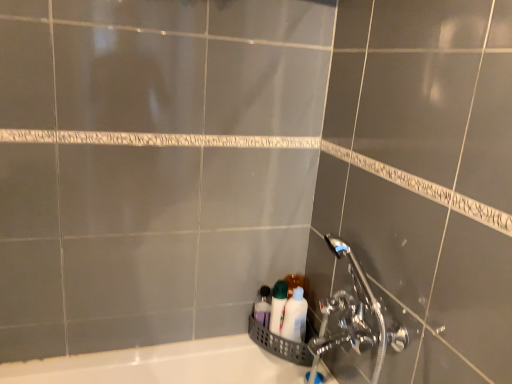
Identify the location of white glossy bottles at lower right, which ranks as the first toiletry in right-to-left order. The width and height of the screenshot is (512, 384). (295, 317).

This screenshot has width=512, height=384. Describe the element at coordinates (295, 317) in the screenshot. I see `white glossy bottles at lower right, which ranks as the first toiletry in right-to-left order` at that location.

This screenshot has width=512, height=384. What do you see at coordinates (263, 306) in the screenshot?
I see `translucent plastic bottles at lower center, marked as the 1th toiletry in a left-to-right arrangement` at bounding box center [263, 306].

At what (x,y) coordinates should I click in order to perform the action: click on translucent plastic bottles at lower center, which ranks as the 2th toiletry in right-to-left order. Please return your answer as a coordinate pair (x, y). The height and width of the screenshot is (384, 512). Looking at the image, I should click on (263, 306).

Find the location of a particular element. This screenshot has height=384, width=512. white glossy bottles at lower right, which ranks as the first toiletry in right-to-left order is located at coordinates (295, 317).

Does white glossy bottles at lower right, which ranks as the first toiletry in right-to-left order, appear on the left side of translucent plastic bottles at lower center, which ranks as the 2th toiletry in right-to-left order?

No.

Is white glossy bottles at lower right, the second toiletry positioned from the left, positioned in front of translucent plastic bottles at lower center, which ranks as the 2th toiletry in right-to-left order?

Yes, white glossy bottles at lower right, the second toiletry positioned from the left, is in front of translucent plastic bottles at lower center, which ranks as the 2th toiletry in right-to-left order.

Is point (295, 340) in front of point (267, 326)?

That is True.

From the image's perspective, between white glossy bottles at lower right, which ranks as the first toiletry in right-to-left order, and translucent plastic bottles at lower center, marked as the 1th toiletry in a left-to-right arrangement, which one is located above?

translucent plastic bottles at lower center, marked as the 1th toiletry in a left-to-right arrangement, is shown above in the image.

From a real-world perspective, between white glossy bottles at lower right, which ranks as the first toiletry in right-to-left order, and translucent plastic bottles at lower center, marked as the 1th toiletry in a left-to-right arrangement, who is vertically higher?

white glossy bottles at lower right, which ranks as the first toiletry in right-to-left order, from a real-world perspective.

Between white glossy bottles at lower right, the second toiletry positioned from the left, and translucent plastic bottles at lower center, which ranks as the 2th toiletry in right-to-left order, which one has smaller width?

translucent plastic bottles at lower center, which ranks as the 2th toiletry in right-to-left order, is thinner.

Is white glossy bottles at lower right, which ranks as the first toiletry in right-to-left order, taller or shorter than translucent plastic bottles at lower center, which ranks as the 2th toiletry in right-to-left order?

Clearly, white glossy bottles at lower right, which ranks as the first toiletry in right-to-left order, is taller compared to translucent plastic bottles at lower center, which ranks as the 2th toiletry in right-to-left order.

Looking at the image, does white glossy bottles at lower right, the second toiletry positioned from the left, seem bigger or smaller compared to translucent plastic bottles at lower center, which ranks as the 2th toiletry in right-to-left order?

In the image, white glossy bottles at lower right, the second toiletry positioned from the left, appears to be larger than translucent plastic bottles at lower center, which ranks as the 2th toiletry in right-to-left order.

Looking at this image, choose the correct answer: Is white glossy bottles at lower right, the second toiletry positioned from the left, inside translucent plastic bottles at lower center, marked as the 1th toiletry in a left-to-right arrangement, or outside it?

white glossy bottles at lower right, the second toiletry positioned from the left, is spatially situated outside translucent plastic bottles at lower center, marked as the 1th toiletry in a left-to-right arrangement.

Would you consider white glossy bottles at lower right, which ranks as the first toiletry in right-to-left order, to be distant from translucent plastic bottles at lower center, marked as the 1th toiletry in a left-to-right arrangement?

white glossy bottles at lower right, which ranks as the first toiletry in right-to-left order, is actually quite close to translucent plastic bottles at lower center, marked as the 1th toiletry in a left-to-right arrangement.

Is white glossy bottles at lower right, the second toiletry positioned from the left, oriented away from translucent plastic bottles at lower center, marked as the 1th toiletry in a left-to-right arrangement?

That's not correct — white glossy bottles at lower right, the second toiletry positioned from the left, is not looking away from translucent plastic bottles at lower center, marked as the 1th toiletry in a left-to-right arrangement.

How many degrees apart are the facing directions of white glossy bottles at lower right, which ranks as the first toiletry in right-to-left order, and translucent plastic bottles at lower center, which ranks as the 2th toiletry in right-to-left order?

white glossy bottles at lower right, which ranks as the first toiletry in right-to-left order, and translucent plastic bottles at lower center, which ranks as the 2th toiletry in right-to-left order, are facing 0.00297 degrees away from each other.

Could you measure the distance between white glossy bottles at lower right, the second toiletry positioned from the left, and translucent plastic bottles at lower center, which ranks as the 2th toiletry in right-to-left order?

A distance of 3.37 inches exists between white glossy bottles at lower right, the second toiletry positioned from the left, and translucent plastic bottles at lower center, which ranks as the 2th toiletry in right-to-left order.

Where is `toiletry on the left of white glossy bottles at lower right, which ranks as the first toiletry in right-to-left order`? toiletry on the left of white glossy bottles at lower right, which ranks as the first toiletry in right-to-left order is located at coordinates coord(263,306).

Is translucent plastic bottles at lower center, marked as the 1th toiletry in a left-to-right arrangement, at the left side of white glossy bottles at lower right, which ranks as the first toiletry in right-to-left order?

Yes.

Does translucent plastic bottles at lower center, which ranks as the 2th toiletry in right-to-left order, come in front of white glossy bottles at lower right, which ranks as the first toiletry in right-to-left order?

No, translucent plastic bottles at lower center, which ranks as the 2th toiletry in right-to-left order, is further to the viewer.

Which is farther from the camera, (266,316) or (298,309)?

Positioned behind is point (266,316).

From the image's perspective, is translucent plastic bottles at lower center, marked as the 1th toiletry in a left-to-right arrangement, below white glossy bottles at lower right, which ranks as the first toiletry in right-to-left order?

No.

From a real-world perspective, which is physically above, translucent plastic bottles at lower center, marked as the 1th toiletry in a left-to-right arrangement, or white glossy bottles at lower right, which ranks as the first toiletry in right-to-left order?

white glossy bottles at lower right, which ranks as the first toiletry in right-to-left order, is physically above.

Is translucent plastic bottles at lower center, which ranks as the 2th toiletry in right-to-left order, wider or thinner than white glossy bottles at lower right, the second toiletry positioned from the left?

Answer: In the image, translucent plastic bottles at lower center, which ranks as the 2th toiletry in right-to-left order, appears to be more narrow than white glossy bottles at lower right, the second toiletry positioned from the left.

Can you confirm if translucent plastic bottles at lower center, marked as the 1th toiletry in a left-to-right arrangement, is taller than white glossy bottles at lower right, which ranks as the first toiletry in right-to-left order?

No, translucent plastic bottles at lower center, marked as the 1th toiletry in a left-to-right arrangement, is not taller than white glossy bottles at lower right, which ranks as the first toiletry in right-to-left order.

Between translucent plastic bottles at lower center, which ranks as the 2th toiletry in right-to-left order, and white glossy bottles at lower right, the second toiletry positioned from the left, which one has larger size?

white glossy bottles at lower right, the second toiletry positioned from the left.

Which is correct: translucent plastic bottles at lower center, marked as the 1th toiletry in a left-to-right arrangement, is inside white glossy bottles at lower right, the second toiletry positioned from the left, or outside of it?

translucent plastic bottles at lower center, marked as the 1th toiletry in a left-to-right arrangement, exists outside the volume of white glossy bottles at lower right, the second toiletry positioned from the left.

Is translucent plastic bottles at lower center, marked as the 1th toiletry in a left-to-right arrangement, touching white glossy bottles at lower right, which ranks as the first toiletry in right-to-left order?

Absolutely, translucent plastic bottles at lower center, marked as the 1th toiletry in a left-to-right arrangement, is next to and touching white glossy bottles at lower right, which ranks as the first toiletry in right-to-left order.

Could you tell me if translucent plastic bottles at lower center, which ranks as the 2th toiletry in right-to-left order, is turned towards white glossy bottles at lower right, which ranks as the first toiletry in right-to-left order?

No, translucent plastic bottles at lower center, which ranks as the 2th toiletry in right-to-left order, is not oriented towards white glossy bottles at lower right, which ranks as the first toiletry in right-to-left order.

How much distance is there between translucent plastic bottles at lower center, marked as the 1th toiletry in a left-to-right arrangement, and white glossy bottles at lower right, which ranks as the first toiletry in right-to-left order?

The distance of translucent plastic bottles at lower center, marked as the 1th toiletry in a left-to-right arrangement, from white glossy bottles at lower right, which ranks as the first toiletry in right-to-left order, is 8.55 centimeters.

Where is `toiletry above the translucent plastic bottles at lower center, which ranks as the 2th toiletry in right-to-left order (from a real-world perspective)`? The width and height of the screenshot is (512, 384). toiletry above the translucent plastic bottles at lower center, which ranks as the 2th toiletry in right-to-left order (from a real-world perspective) is located at coordinates (295, 317).

Locate an element on the screen. toiletry on the left side of white glossy bottles at lower right, which ranks as the first toiletry in right-to-left order is located at coordinates (263, 306).

You are a GUI agent. You are given a task and a screenshot of the screen. Output one action in this format:
    pyautogui.click(x=<x>, y=<y>)
    Task: Click on the toiletry that is above the white glossy bottles at lower right, which ranks as the first toiletry in right-to-left order (from the image's perspective)
    
    Given the screenshot: What is the action you would take?
    pyautogui.click(x=263, y=306)